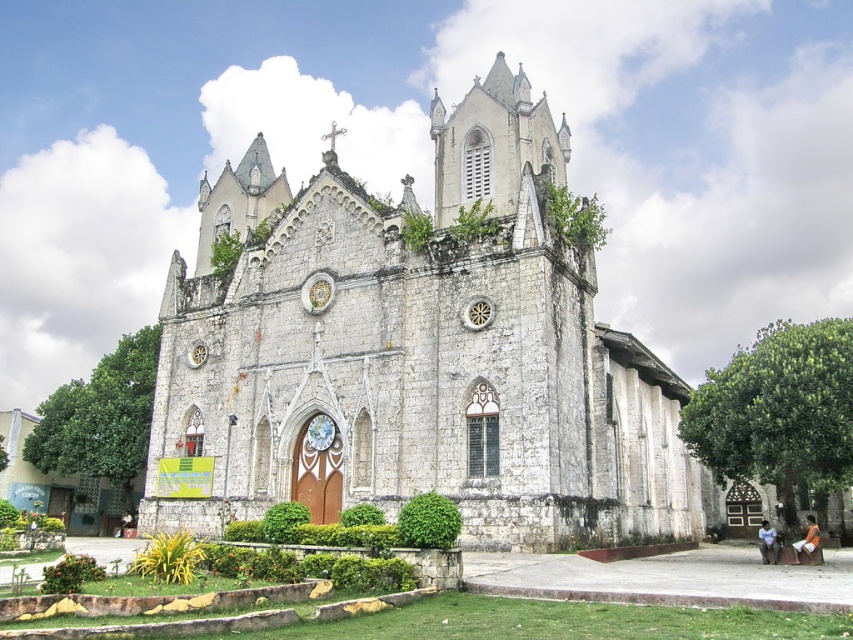
You are standing in front of the historic stone church and want to locate the white stone chapel at center. According to the coordinates provided, where would you find it?

The white stone chapel at center is located at the coordinates point (x=415, y=353).

You are standing in front of the historic stone church and see a blue denim shirt at lower right and an orange cotton shorts at lower right. Which clothing item is narrower in width?

The blue denim shirt at lower right is thinner than orange cotton shorts at lower right, so the blue denim shirt at lower right is narrower in width.

You are standing in front of the historic stone church described in the scene. There is a point marked at coordinates point (415, 353). Based on the description, where would this point most likely be located on the church?

The point (415, 353) corresponds to the white stone chapel at center, which is the central area of the church structure.